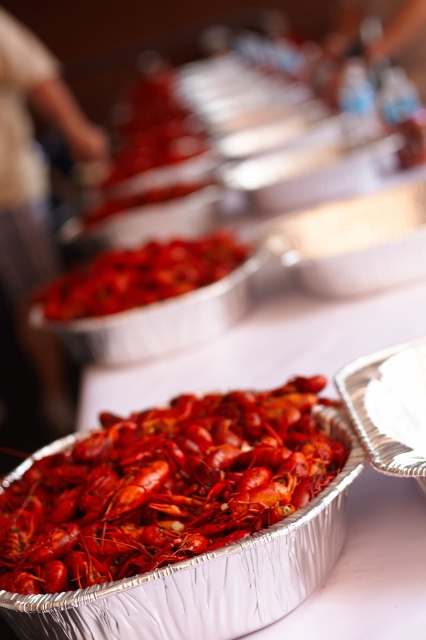
You are a photographer adjusting your camera focus. You notice two points in the image, point (5, 518) and point (54, 292). Which point should you focus on to capture the crawfish in the foreground more clearly?

Point (5, 518) is closer to the viewer than point (54, 292), so focusing on point (5, 518) will capture the crawfish in the foreground more clearly.

You are a food photographer trying to capture the crawfish boil. You want to ensure that both the shiny red lobster at center and the bright red crayfish at center are clearly visible in your shot. Given their sizes, which one might you need to position closer to the camera to maintain clarity?

The shiny red lobster at center has a lesser width compared to the bright red crayfish at center, so you might need to position the shiny red lobster at center closer to the camera to ensure it appears clear and not overshadowed by the larger crayfish.